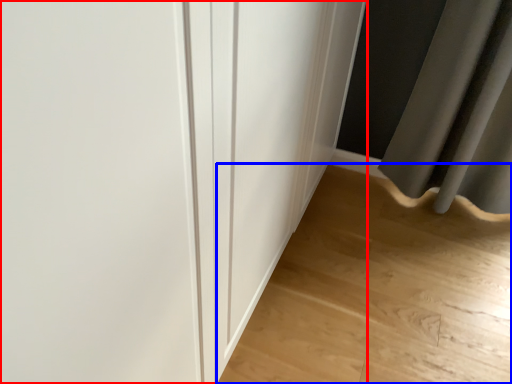
Question: Among these objects, which one is farthest to the camera, door (highlighted by a red box) or corridor (highlighted by a blue box)?

Choices:
 (A) door
 (B) corridor

Answer: (B)